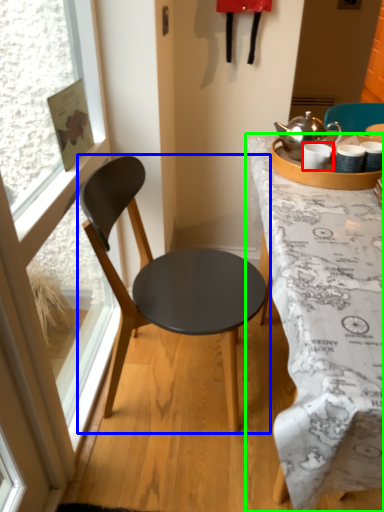
Question: Estimate the real-world distances between objects in this image. Which object is closer to coffee cup (highlighted by a red box), chair (highlighted by a blue box) or desk (highlighted by a green box)?

Choices:
 (A) chair
 (B) desk

Answer: (B)